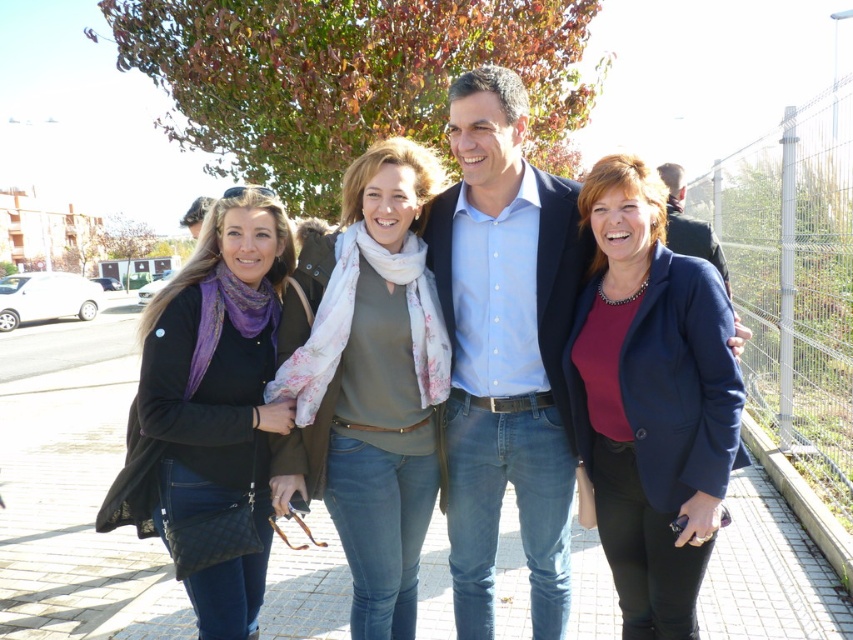
You are standing in the plaza and want to hand a brochure to both the person wearing the floral scarf at center and the one in the black quilted jacket at left. Which person should you approach first to ensure you can reach them without moving past the other?

You should approach the floral scarf at center first because it is closer to you than the black quilted jacket at left, so you can reach them without needing to move past the other person.

In the scene shown: You are a photographer trying to capture a closeup shot of the floral scarf at center and the black quilted jacket at left. Which object should you zoom in on to ensure it takes up more of the frame?

The black quilted jacket at left takes up more space than the floral scarf at center, so you should zoom in on the black quilted jacket at left to ensure it occupies more of the frame.

You are a photographer trying to capture a closeup of the matte black jacket at center and the floral scarf at center. Since you want to focus on both items clearly, which one should you adjust your camera focus on first considering their sizes?

The matte black jacket at center is taller than the floral scarf at center, so you should focus on the matte black jacket at center first as it is larger and will require more precise focus.